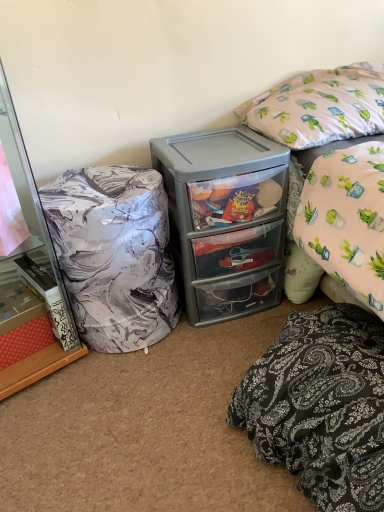
The width and height of the screenshot is (384, 512). In order to click on vacant space in front of marble-patterned fabric at left in this screenshot , I will do `click(58, 429)`.